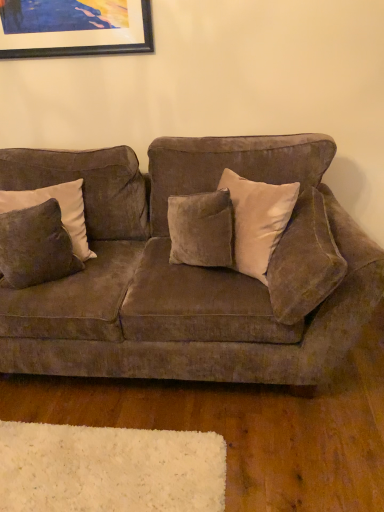
Question: Is velvet brown couch at center inside or outside of suede pillow at right, positioned as the second pillow in left-to-right order?

Choices:
 (A) outside
 (B) inside

Answer: (A)

Question: Considering the positions of velvet brown couch at center and suede pillow at right, the first pillow from the right, in the image, is velvet brown couch at center wider or thinner than suede pillow at right, the first pillow from the right,?

Choices:
 (A) thin
 (B) wide

Answer: (B)

Question: Which object is positioned closest to the velvet brown pillow at left, placed as the 2th pillow when sorted from right to left?

Choices:
 (A) suede pillow at right, positioned as the second pillow in left-to-right order
 (B) velvet brown couch at center
 (C) wooden picture frame at upper left

Answer: (B)

Question: Based on their relative distances, which object is farther from the wooden picture frame at upper left?

Choices:
 (A) velvet brown pillow at left, which ranks as the first pillow in left-to-right order
 (B) suede pillow at right, positioned as the second pillow in left-to-right order
 (C) velvet brown couch at center

Answer: (B)